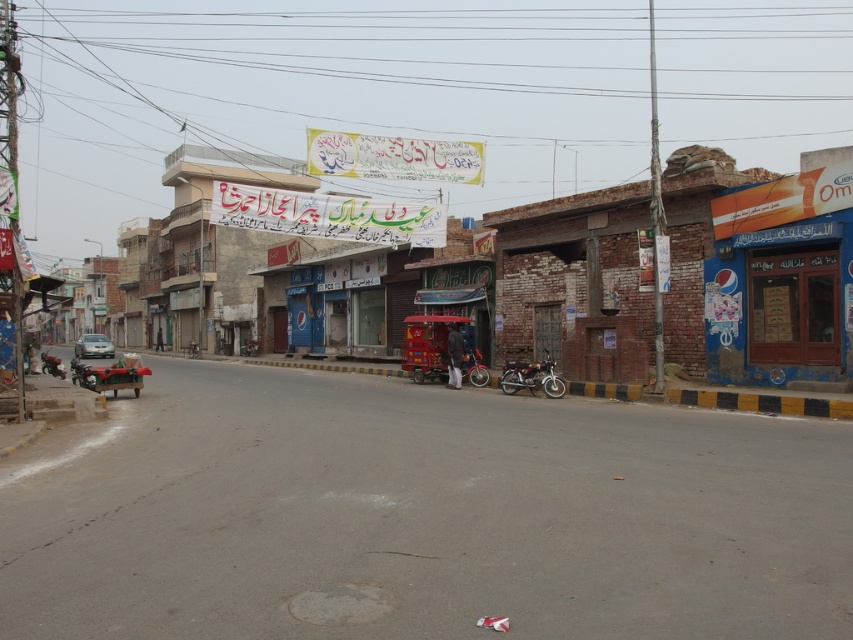
You are a delivery driver who needs to park your vehicle in this area. You have a shiny chrome motorcycle at center and a silver metallic car at left. Which vehicle takes up less space to park?

The shiny chrome motorcycle at center has a smaller size compared to the silver metallic car at left, so it requires less space to park.

You are a delivery person who needs to park your vehicle between two motorcycles. The shiny chrome motorcycle at center and the shiny metallic motorcycle at lower left are in your way. Which motorcycle should you move to the left to create space?

You should move the shiny metallic motorcycle at lower left to the left because the shiny chrome motorcycle at center is already to the right of it, so moving the left one further left would create space between them.